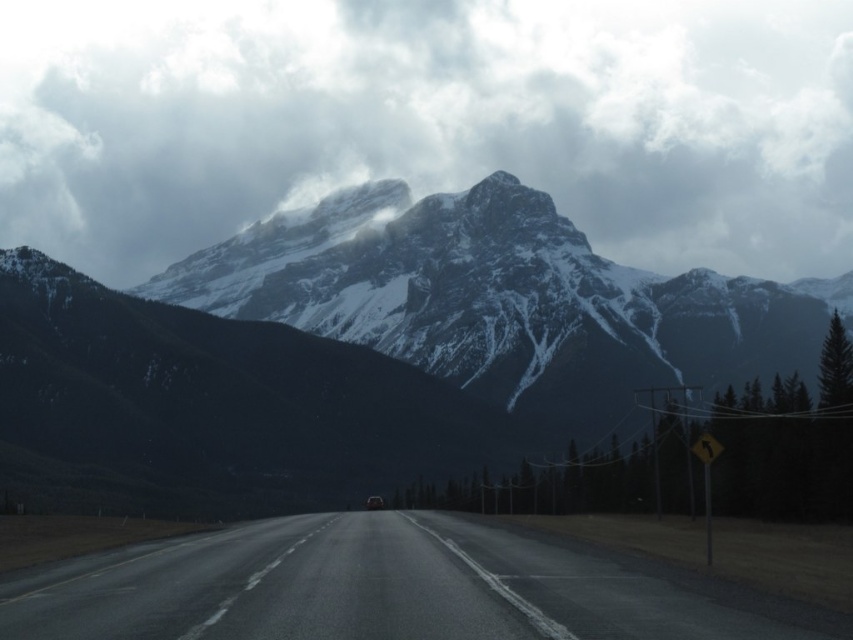
Question: Can you confirm if snowy granite mountain range at upper center is smaller than shiny silver car at center?

Choices:
 (A) yes
 (B) no

Answer: (B)

Question: Estimate the real-world distances between objects in this image. Which object is farther from the asphalt road at center?

Choices:
 (A) snowy granite mountain range at upper center
 (B) shiny silver car at center
 (C) snowy rock formation at upper center

Answer: (C)

Question: Is snowy granite mountain range at upper center bigger than shiny silver car at center?

Choices:
 (A) no
 (B) yes

Answer: (B)

Question: Does snowy granite mountain range at upper center appear under shiny silver car at center?

Choices:
 (A) no
 (B) yes

Answer: (A)

Question: Which point is farther to the camera?

Choices:
 (A) shiny silver car at center
 (B) snowy rock formation at upper center
 (C) snowy granite mountain range at upper center
 (D) asphalt road at center

Answer: (B)

Question: Which point appears farthest from the camera in this image?

Choices:
 (A) (433, 429)
 (B) (244, 548)
 (C) (817, 38)

Answer: (C)